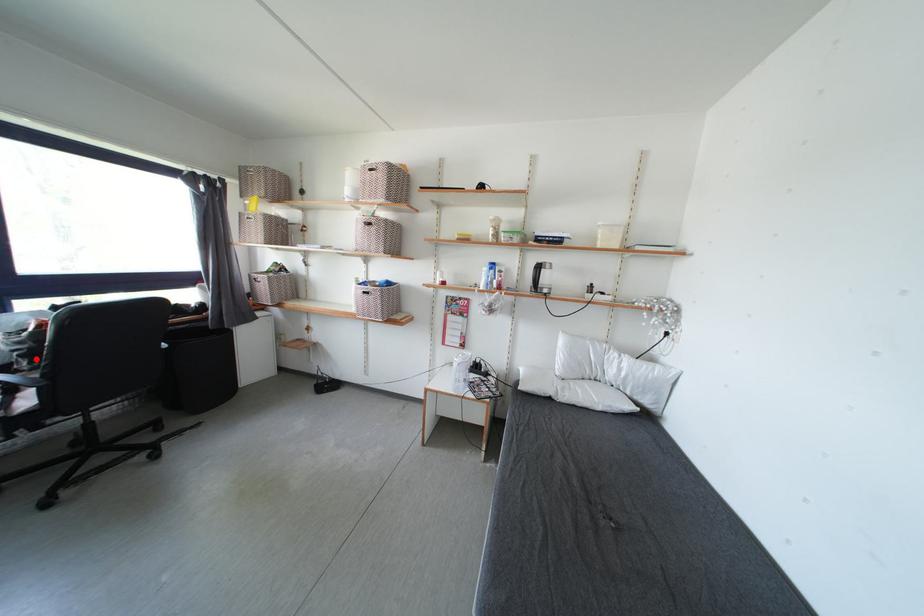
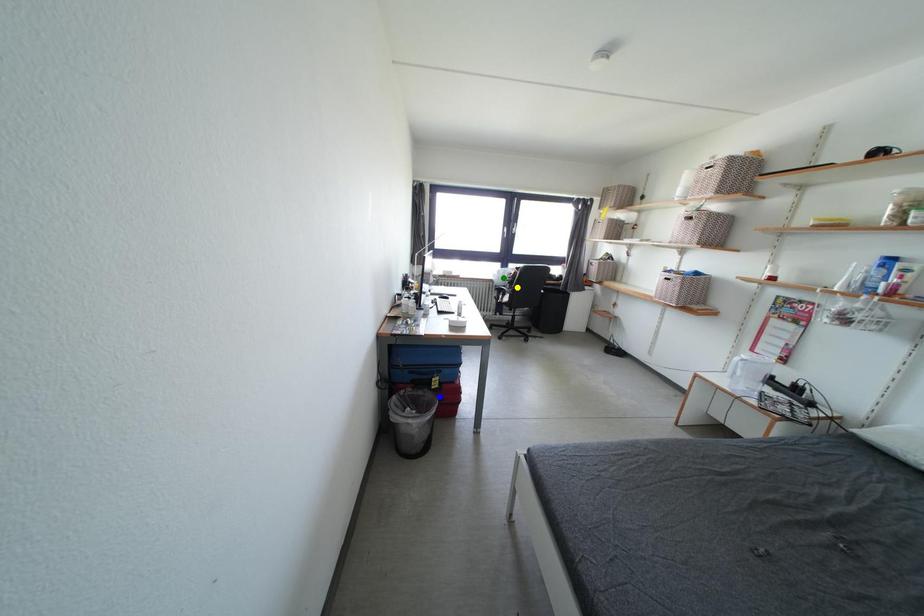
Question: I am providing you with two images of the same scene from different viewpoints. A red point is marked on the first image. You are given multiple points on the second image. Which mark in image 2 goes with the point in image 1?

Choices:
 (A) yellow point
 (B) green point
 (C) blue point

Answer: (A)